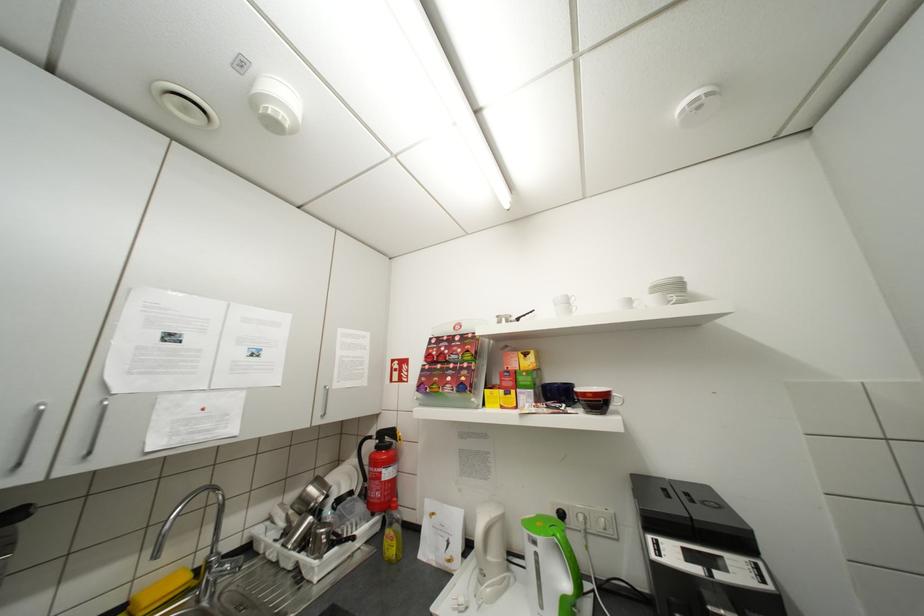
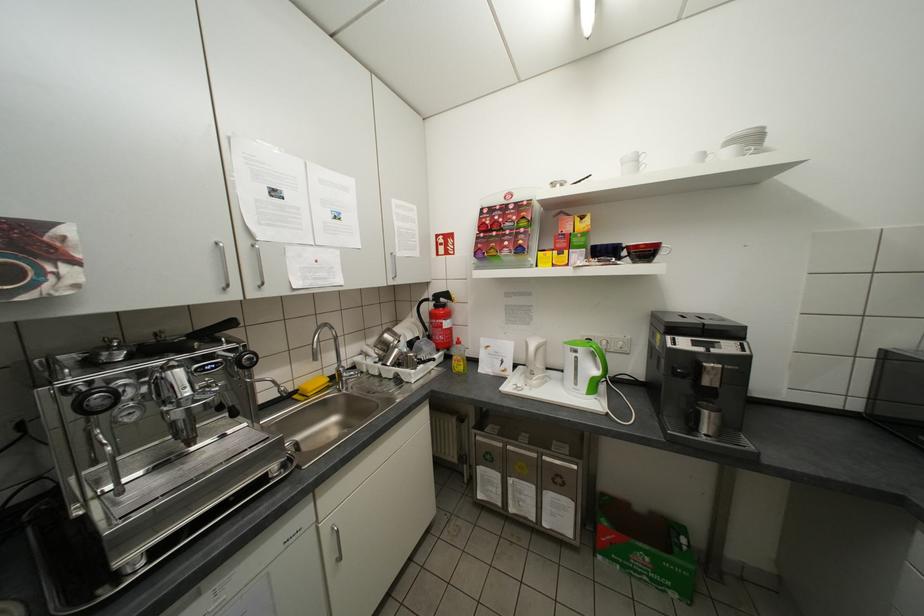
In the second image, find the point that corresponds to (700,517) in the first image.

(712, 323)